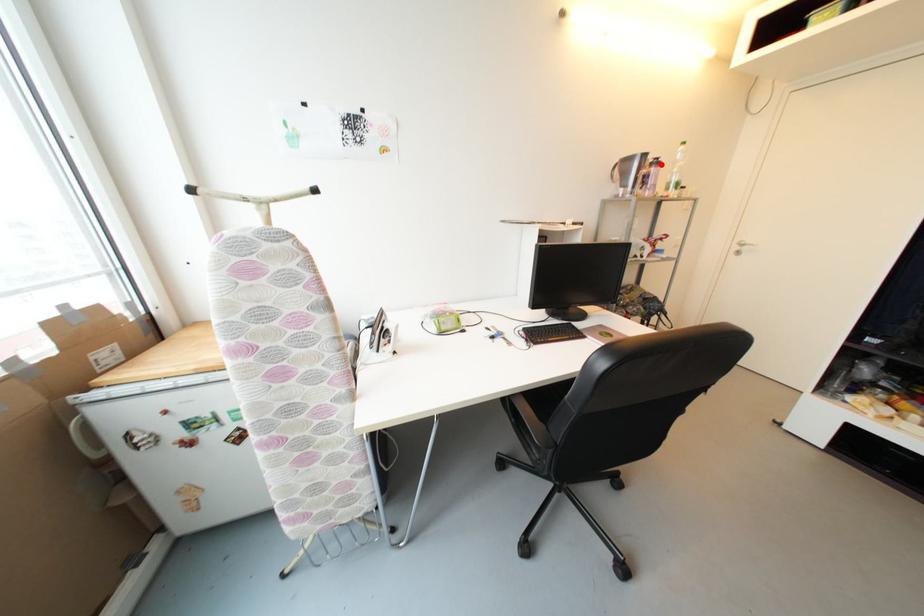
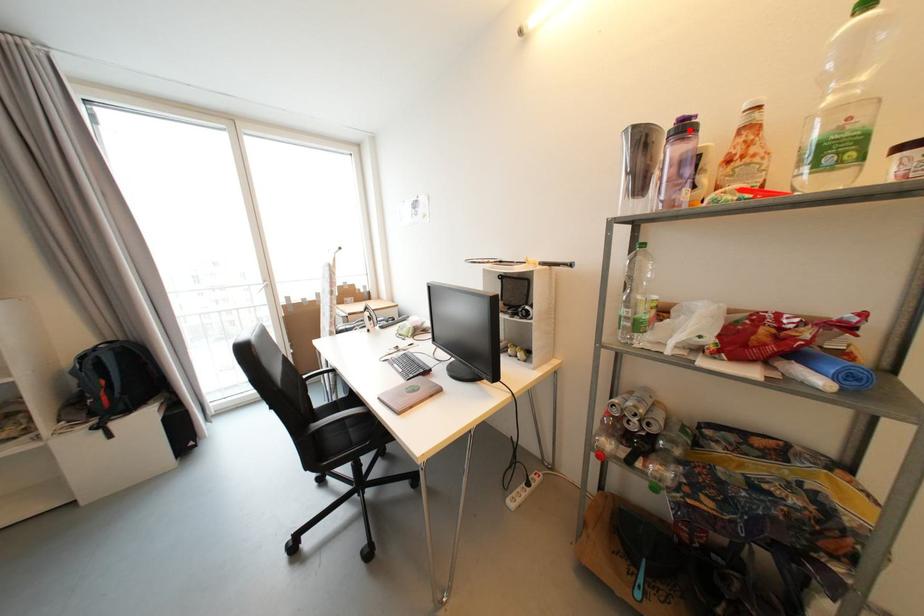
I am providing you with two images of the same scene from different viewpoints. A red point is marked on the first image and another point is marked on the second image. Are the points marked in image1 and image2 representing the same 3D position?

Yes